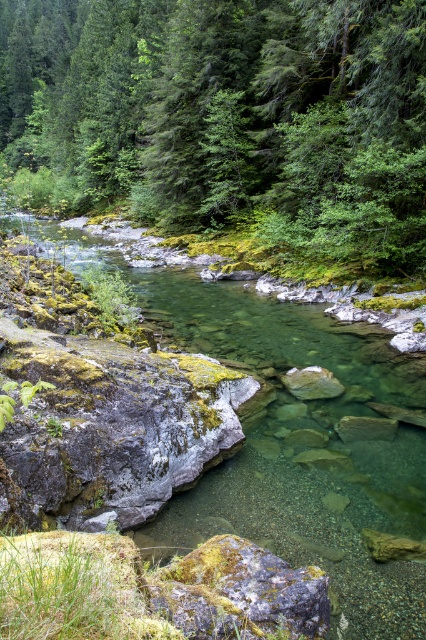
Question: Which point appears farthest from the camera in this image?

Choices:
 (A) (232, 620)
 (B) (36, 177)

Answer: (B)

Question: Which point is closer to the camera?

Choices:
 (A) mossy gray rock at center
 (B) green matte tree at center

Answer: (A)

Question: Is green matte tree at center below mossy gray rock at center?

Choices:
 (A) yes
 (B) no

Answer: (B)

Question: From the image, what is the correct spatial relationship of green matte tree at center in relation to mossy gray rock at center?

Choices:
 (A) below
 (B) above

Answer: (B)

Question: Is green matte tree at center smaller than mossy gray rock at center?

Choices:
 (A) no
 (B) yes

Answer: (A)